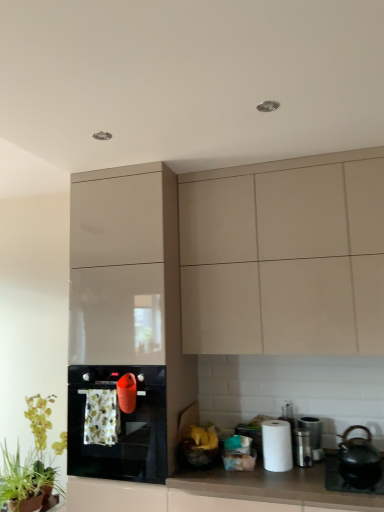
Question: Can you confirm if metallic silver trash can at lower right, marked as the 2th appliance in a back-to-front arrangement, is taller than green leafy plant at lower left, which is the first plant from back to front?

Choices:
 (A) no
 (B) yes

Answer: (A)

Question: Can you confirm if metallic silver trash can at lower right, marked as the 1th appliance in a front-to-back arrangement, is thinner than green leafy plant at lower left, which is the 2th plant in front-to-back order?

Choices:
 (A) no
 (B) yes

Answer: (B)

Question: Is metallic silver trash can at lower right, marked as the 2th appliance in a back-to-front arrangement, aimed at green leafy plant at lower left, which is the first plant from back to front?

Choices:
 (A) no
 (B) yes

Answer: (A)

Question: From the image's perspective, is metallic silver trash can at lower right, marked as the 1th appliance in a front-to-back arrangement, below green leafy plant at lower left, which is the 2th plant in front-to-back order?

Choices:
 (A) yes
 (B) no

Answer: (B)

Question: Is metallic silver trash can at lower right, marked as the 2th appliance in a back-to-front arrangement, looking in the opposite direction of green leafy plant at lower left, which is the 2th plant in front-to-back order?

Choices:
 (A) no
 (B) yes

Answer: (A)

Question: Considering the positions of white matte countertop at lower center and matte beige cabinet at upper center, which appears as the second cabinetry when viewed from the left, in the image, is white matte countertop at lower center taller or shorter than matte beige cabinet at upper center, which appears as the second cabinetry when viewed from the left,?

Choices:
 (A) short
 (B) tall

Answer: (A)

Question: Visually, is white matte countertop at lower center positioned to the left or to the right of matte beige cabinet at upper center, which appears as the second cabinetry when viewed from the left?

Choices:
 (A) left
 (B) right

Answer: (A)

Question: In terms of width, does white matte countertop at lower center look wider or thinner when compared to matte beige cabinet at upper center, which appears as the second cabinetry when viewed from the left?

Choices:
 (A) thin
 (B) wide

Answer: (B)

Question: From the image's perspective, is white matte countertop at lower center above or below matte beige cabinet at upper center, which is counted as the 1th cabinetry, starting from the right?

Choices:
 (A) below
 (B) above

Answer: (A)

Question: From a real-world perspective, is satin silver canister at lower right, arranged as the second appliance when viewed from the front, positioned above or below green leafy plant at lower left, marked as the first plant in a front-to-back arrangement?

Choices:
 (A) below
 (B) above

Answer: (B)

Question: Considering the positions of satin silver canister at lower right, arranged as the second appliance when viewed from the front, and green leafy plant at lower left, which is the 2th plant in back-to-front order, in the image, is satin silver canister at lower right, arranged as the second appliance when viewed from the front, taller or shorter than green leafy plant at lower left, which is the 2th plant in back-to-front order,?

Choices:
 (A) tall
 (B) short

Answer: (B)

Question: Would you say satin silver canister at lower right, marked as the first appliance in a back-to-front arrangement, is to the left or to the right of green leafy plant at lower left, which is the 2th plant in back-to-front order, in the picture?

Choices:
 (A) left
 (B) right

Answer: (B)

Question: Is satin silver canister at lower right, marked as the first appliance in a back-to-front arrangement, bigger or smaller than green leafy plant at lower left, marked as the first plant in a front-to-back arrangement?

Choices:
 (A) big
 (B) small

Answer: (B)

Question: Is point (150, 253) closer or farther from the camera than point (370, 184)?

Choices:
 (A) farther
 (B) closer

Answer: (A)

Question: Considering the positions of glossy beige cabinet at center, marked as the 2th cabinetry in a right-to-left arrangement, and matte beige cabinet at upper center, which appears as the second cabinetry when viewed from the left, in the image, is glossy beige cabinet at center, marked as the 2th cabinetry in a right-to-left arrangement, wider or thinner than matte beige cabinet at upper center, which appears as the second cabinetry when viewed from the left,?

Choices:
 (A) thin
 (B) wide

Answer: (B)